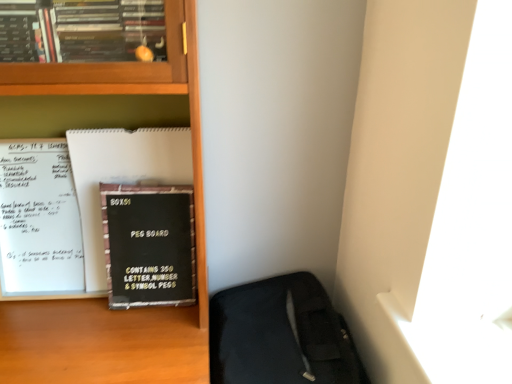
Question: In terms of width, does wooden bookcase at center look wider or thinner when compared to black matte peg board at center-left?

Choices:
 (A) wide
 (B) thin

Answer: (A)

Question: Relative to black matte peg board at center-left, is wooden bookcase at center in front or behind?

Choices:
 (A) behind
 (B) front

Answer: (B)

Question: Which object is positioned farthest from the black matte peg board at center-left?

Choices:
 (A) wooden bookcase at center
 (B) black matte peg board at left
 (C) black fabric sleeping bag at lower right

Answer: (C)

Question: Which of these objects is positioned farthest from the wooden bookcase at center?

Choices:
 (A) black matte peg board at center-left
 (B) black fabric sleeping bag at lower right
 (C) black matte peg board at left

Answer: (B)